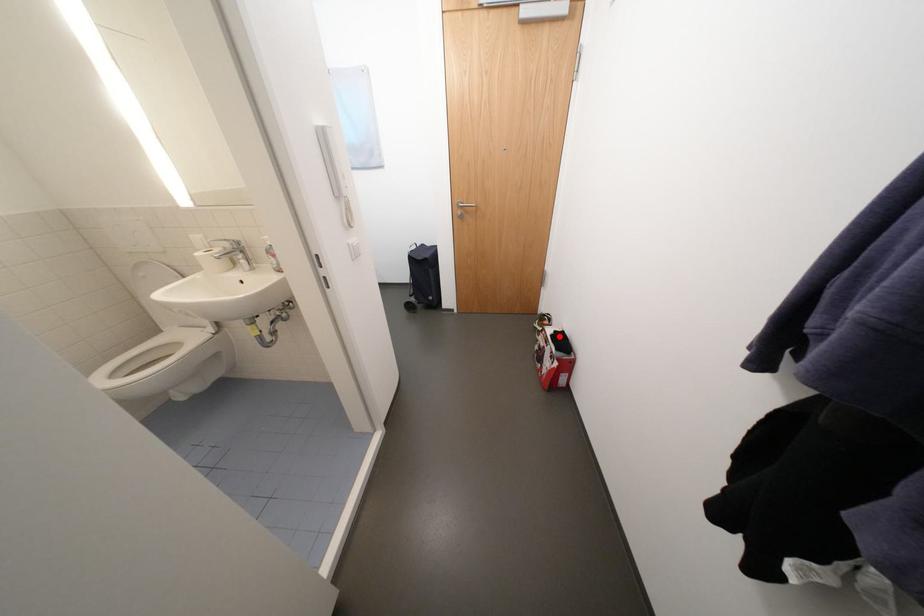
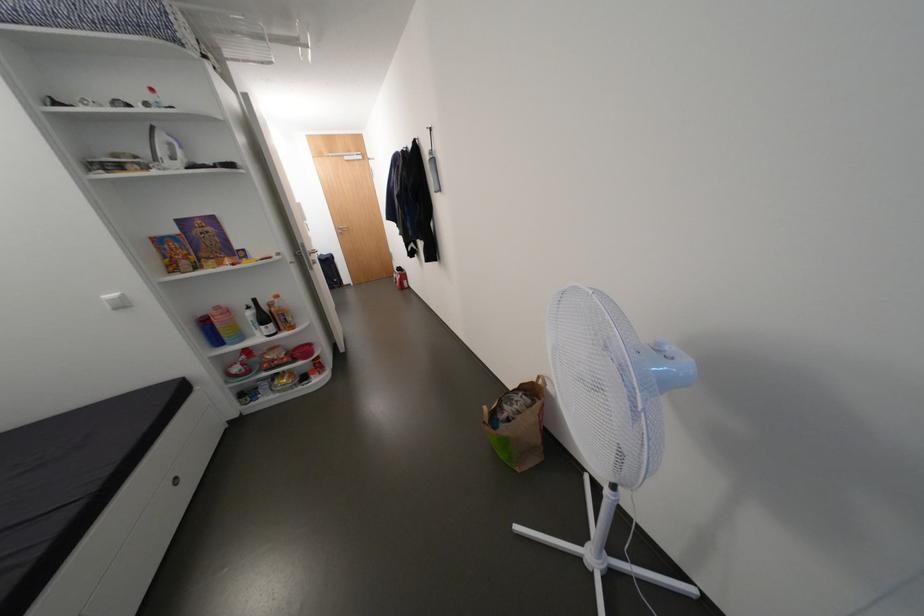
Question: I am providing you with two images of the same scene from different viewpoints. In image1, a red point is highlighted. Considering the same 3D point in image2, which of the following is correct?

Choices:
 (A) It is closer
 (B) It is farther

Answer: (B)